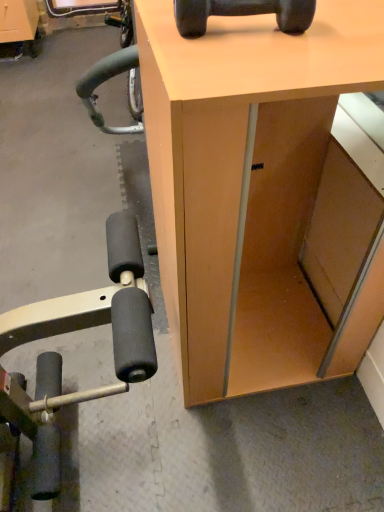
Find the location of `empty space that is ontop of matte wood desk at center (from a real-world perspective)`. empty space that is ontop of matte wood desk at center (from a real-world perspective) is located at coordinates (284, 35).